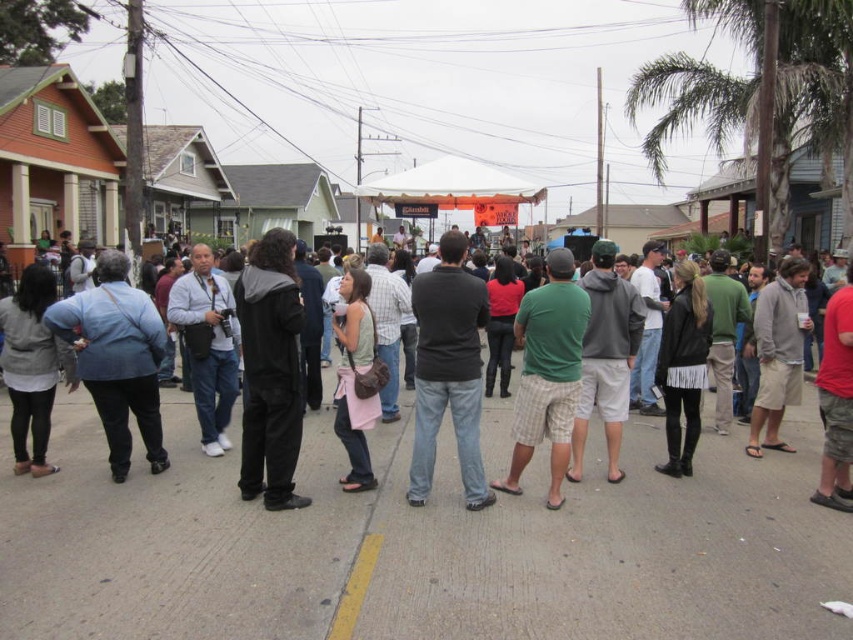
Question: Can you confirm if black leather jacket at center is thinner than green plaid shorts at center?

Choices:
 (A) yes
 (B) no

Answer: (A)

Question: Does matte black jacket at left have a greater width compared to green fabric dress at center?

Choices:
 (A) yes
 (B) no

Answer: (A)

Question: Which point is closer to the camera?

Choices:
 (A) (418, 349)
 (B) (225, 408)

Answer: (A)

Question: Is black matte jumpsuit at center closer to the viewer compared to green plaid shorts at center?

Choices:
 (A) no
 (B) yes

Answer: (B)

Question: Which point appears closest to the camera in this image?

Choices:
 (A) [271, 433]
 (B) [38, 365]
 (C) [109, 444]

Answer: (A)

Question: Which of the following is the farthest from the observer?

Choices:
 (A) (357, 428)
 (B) (103, 387)
 (C) (3, 374)

Answer: (C)